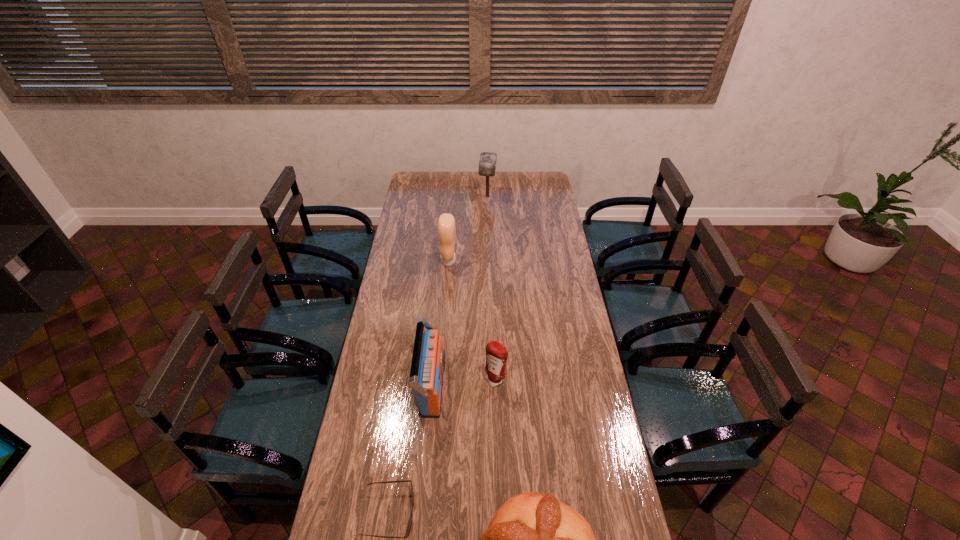
Where is `object present at the far edge`? object present at the far edge is located at coordinates (487, 165).

Locate an element on the screen. vacant area at the far edge is located at coordinates (520, 185).

In the image, there is a desktop. Find the location of `free space at the left edge`. free space at the left edge is located at coordinates (416, 215).

At what (x,y) coordinates should I click in order to perform the action: click on vacant space at the right edge of the desktop. Please return your answer as a coordinate pair (x, y). Looking at the image, I should click on (591, 358).

In the image, there is a desktop. In order to click on free space at the far right corner in this screenshot , I will do (x=550, y=176).

The image size is (960, 540). Identify the location of free space that is in between the fifth nearest object and the nearer condiment. (472, 320).

Identify the location of free space between the left condiment and the farthest object. The height and width of the screenshot is (540, 960). (468, 229).

The image size is (960, 540). I want to click on empty space that is in between the radio receiver and the farthest object, so click(x=460, y=292).

Locate an element on the screen. The image size is (960, 540). vacant point located between the fifth nearest object and the right condiment is located at coordinates (472, 320).

In order to click on blank region between the radio receiver and the right condiment in this screenshot , I will do `click(464, 383)`.